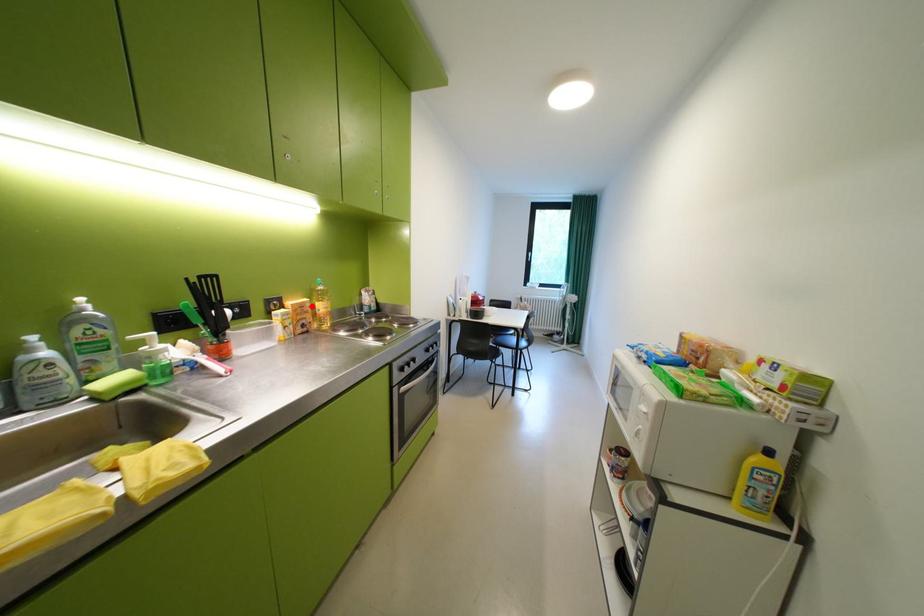
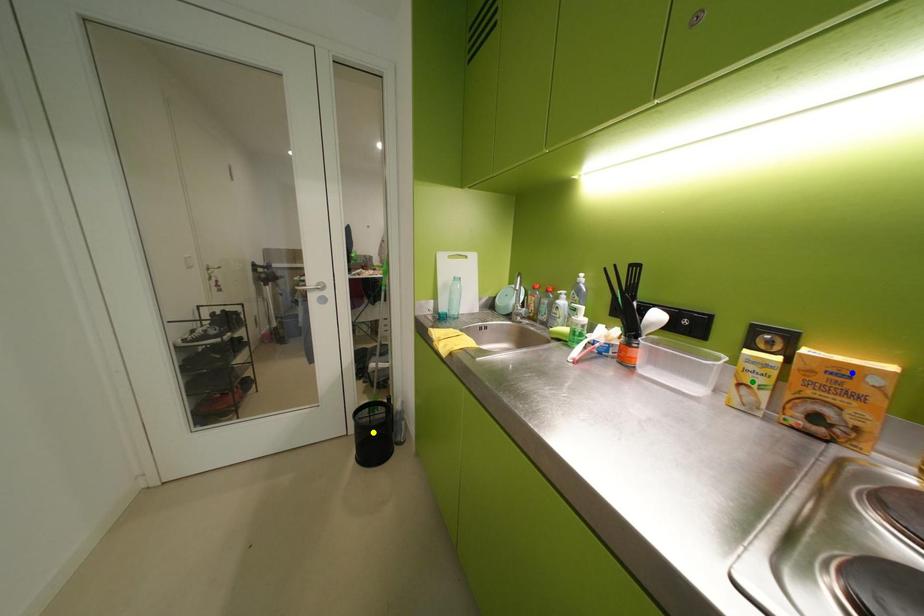
Question: I am providing you with two images of the same scene from different viewpoints. A red point is marked on the first image. You are given multiple points on the second image. Which point in image 2 represents the same 3d spot as the red point in image 1?

Choices:
 (A) green point
 (B) blue point
 (C) yellow point

Answer: (B)